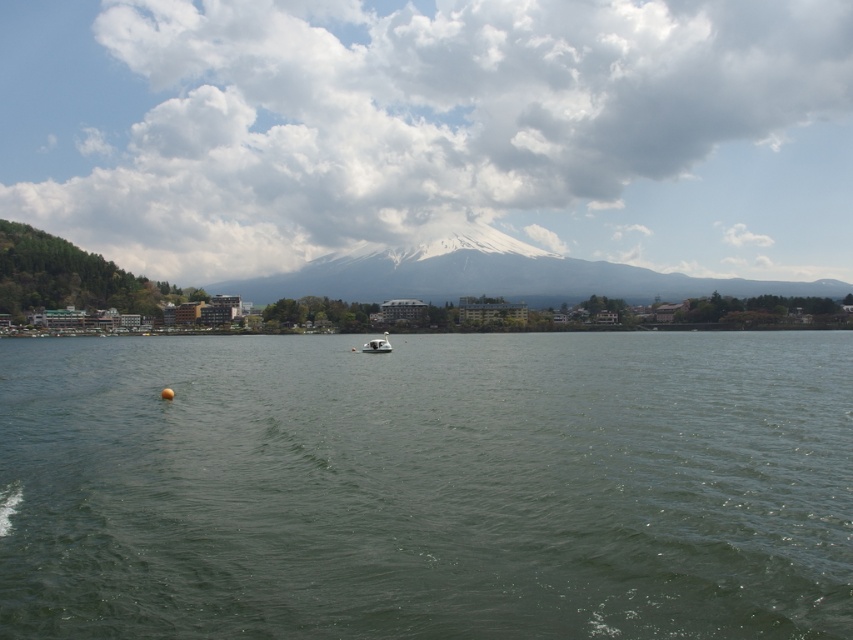
Is white snow-covered mountain at center thinner than white glossy boat at center?

In fact, white snow-covered mountain at center might be wider than white glossy boat at center.

Is white snow-covered mountain at center in front of white glossy boat at center?

No, it is behind white glossy boat at center.

Who is more distant from viewer, (x=485, y=289) or (x=369, y=346)?

The point (x=485, y=289) is more distant.

At what (x,y) coordinates should I click in order to perform the action: click on white snow-covered mountain at center. Please return your answer as a coordinate pair (x, y). Looking at the image, I should click on (492, 275).

Is point (169, 544) closer to viewer compared to point (384, 332)?

Yes, point (169, 544) is in front of point (384, 332).

Looking at this image, does green water at center appear under white glossy boat at center?

Indeed, green water at center is positioned under white glossy boat at center.

What are the coordinates of `green water at center` in the screenshot? It's located at (427, 486).

Does green water at center have a greater width compared to white snow-covered mountain at center?

No.

Which of these two, green water at center or white snow-covered mountain at center, stands shorter?

Standing shorter between the two is green water at center.

Is point (47, 522) positioned in front of point (321, 291)?

Yes, it is.

Where is `green water at center`? The width and height of the screenshot is (853, 640). green water at center is located at coordinates (427, 486).